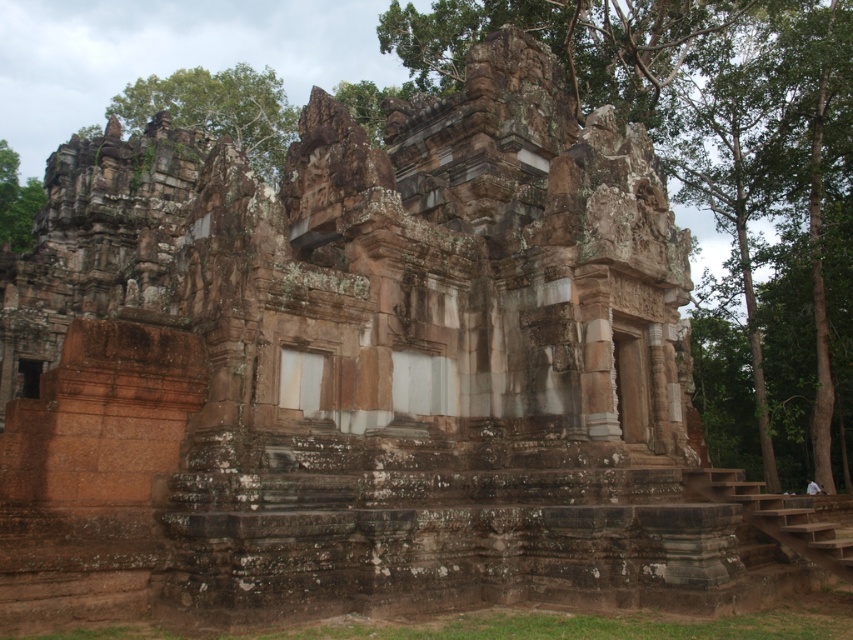
You are an archaeologist examining the ancient stone structure. You notice the green mossy stone temple at center and the green leafy tree at upper left. Which object is positioned higher in the image?

The green leafy tree at upper left is positioned higher in the image than the green mossy stone temple at center.

You are an archaeologist examining the ancient stone structure. From your vantage point, can you see the green mossy tree at upper left behind the green mossy stone temple at center?

Yes, the green mossy stone temple at center is in front of the green mossy tree at upper left, so the tree is visible behind it.

You are a hiker who wants to take a photo of the green mossy stone temple at center and the green mossy tree at upper left in the same frame. Given that your camera has a maximum zoom range of 100 meters, will you be able to capture both objects in one photo?

The distance between the green mossy stone temple at center and the green mossy tree at upper left is 133.07 meters, which exceeds the camera maximum zoom range of 100 meters. Therefore, you cannot capture both objects in one photo.